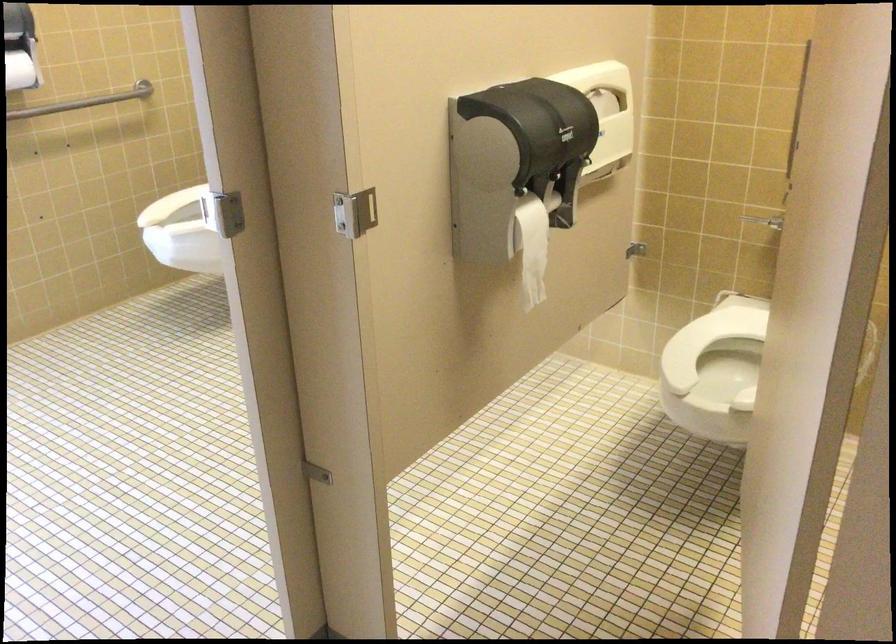
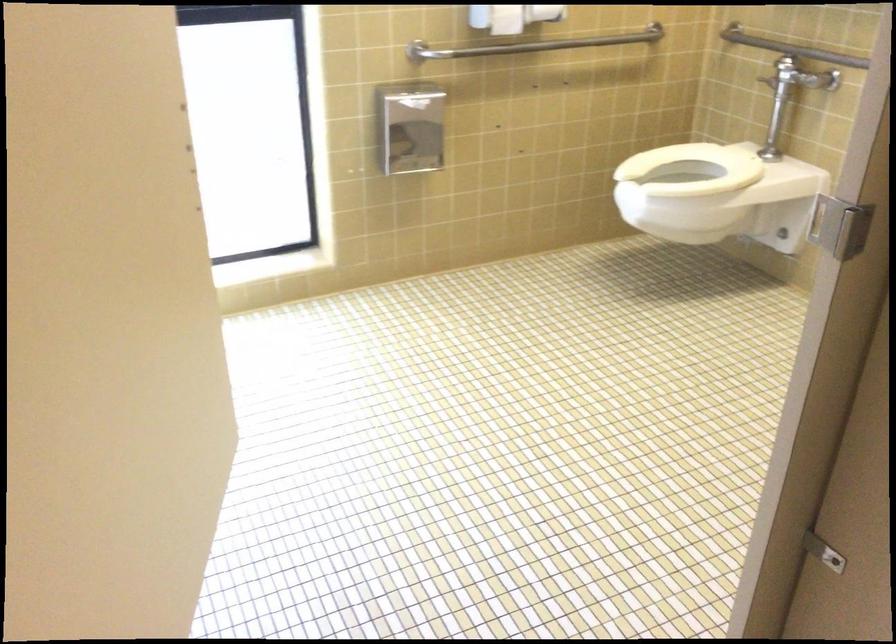
What movement of the cameraman would produce the second image?

The cameraman moved toward left, forward.